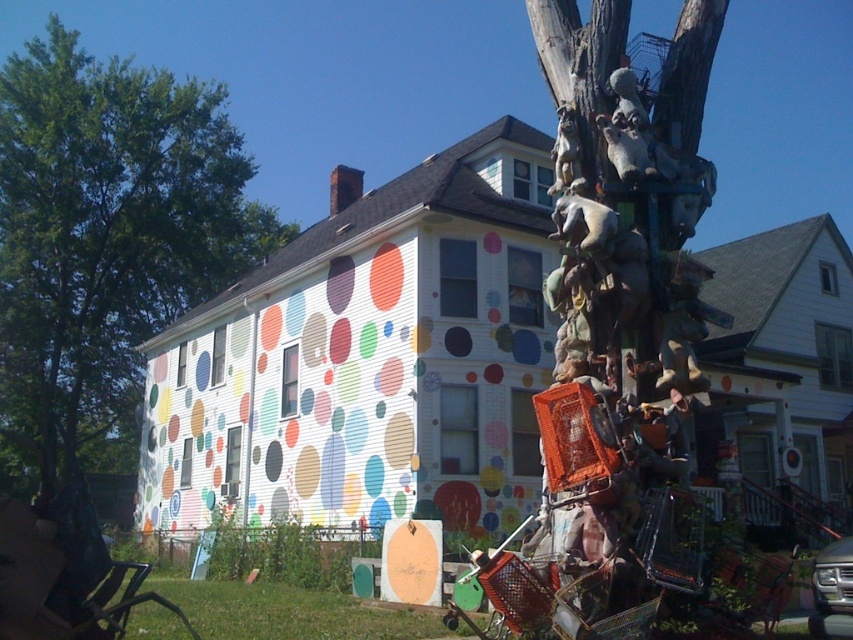
You are standing in front of the house and want to take a photo of the green leafy tree at upper left. If your camera can focus on objects up to 5 meters away, will you be able to capture a clear photo of the tree?

The green leafy tree at upper left is 6.34 meters from viewer, which is beyond the camera focus range of 5 meters. Therefore, the camera cannot capture a clear photo of the tree.

You are standing in front of the house and notice a point marked at coordinates (105,241). Based on the scene description, can you determine which object this point is located on?

The point at coordinates (105,241) is located on the green leafy tree at upper left.

You are a delivery drone carrying a package weighing 10 pounds. The maximum flight distance your drone can travel is 50 feet before needing to recharge. You need to deliver the package to the green grass at lower center, but you are currently hovering near the green leafy tree at upper left. Can your drone make the delivery without needing to recharge?

The distance between the green leafy tree at upper left and the green grass at lower center is 53.43 feet, which exceeds the drone s 50 feet maximum flight distance. Therefore, the drone cannot make the delivery without recharging.